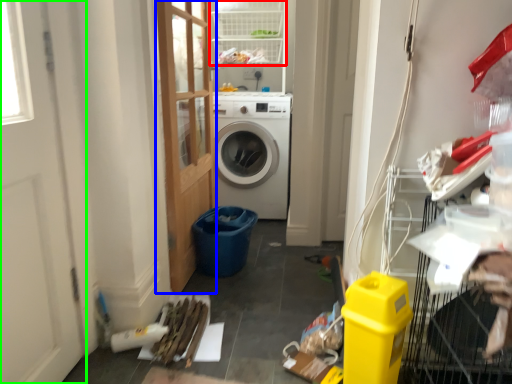
Question: Which object is the farthest from shelf (highlighted by a red box)? Choose among these: door (highlighted by a blue box) or screen door (highlighted by a green box).

Choices:
 (A) door
 (B) screen door

Answer: (B)